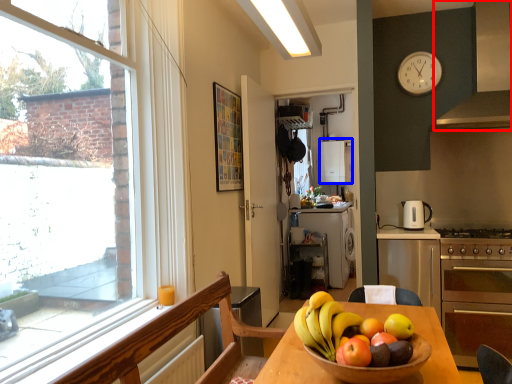
Question: Which object appears farthest to the camera in this image, exhaust hood (highlighted by a red box) or appliance (highlighted by a blue box)?

Choices:
 (A) exhaust hood
 (B) appliance

Answer: (B)